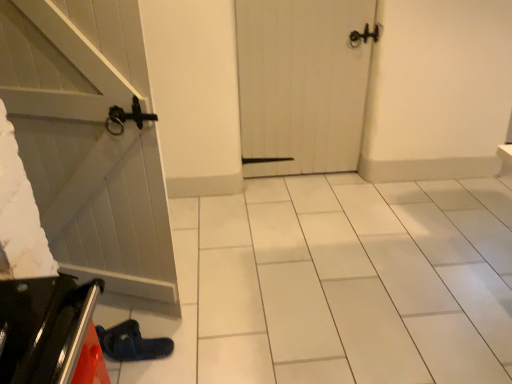
Describe the element at coordinates (303, 82) in the screenshot. The image size is (512, 384). I see `white wooden door at center` at that location.

Describe the element at coordinates (47, 330) in the screenshot. I see `shiny metallic oven at lower left` at that location.

In order to click on blue suede slipper at lower left in this screenshot , I will do `click(132, 343)`.

Where is `white wooden door at center`? The width and height of the screenshot is (512, 384). white wooden door at center is located at coordinates (303, 82).

Does white wooden door at center contain blue suede slipper at lower left?

No, blue suede slipper at lower left is not inside white wooden door at center.

Between white wooden door at center and blue suede slipper at lower left, which one has smaller width?

white wooden door at center is thinner.

Does white wooden door at center come in front of blue suede slipper at lower left?

No.

How different are the orientations of white wooden door at center and blue suede slipper at lower left in degrees?

The angular difference between white wooden door at center and blue suede slipper at lower left is 87.9 degrees.

In terms of height, does blue suede slipper at lower left look taller or shorter compared to white wooden door at center?

Clearly, blue suede slipper at lower left is shorter compared to white wooden door at center.

Looking at the image, does blue suede slipper at lower left seem bigger or smaller compared to white wooden door at center?

Clearly, blue suede slipper at lower left is smaller in size than white wooden door at center.

Does blue suede slipper at lower left have a lesser width compared to white wooden door at center?

No, blue suede slipper at lower left is not thinner than white wooden door at center.

Consider the image. Is blue suede slipper at lower left far away from white wooden door at center?

That's right, there is a large distance between blue suede slipper at lower left and white wooden door at center.

Who is smaller, white wooden door at center or shiny metallic oven at lower left?

With smaller size is shiny metallic oven at lower left.

Does white wooden door at center lie behind shiny metallic oven at lower left?

Yes, white wooden door at center is further from the viewer.

Considering the relative sizes of shiny metallic oven at lower left and white wooden door at center in the image provided, is shiny metallic oven at lower left bigger than white wooden door at center?

No, shiny metallic oven at lower left is not bigger than white wooden door at center.

From the picture: Are shiny metallic oven at lower left and white wooden door at center beside each other?

No, shiny metallic oven at lower left is not next to white wooden door at center.

Does shiny metallic oven at lower left come in front of white wooden door at center?

Yes, shiny metallic oven at lower left is in front of white wooden door at center.

Identify the location of footwear below the shiny metallic oven at lower left (from a real-world perspective). [132, 343].

Who is bigger, blue suede slipper at lower left or shiny metallic oven at lower left?

With larger size is shiny metallic oven at lower left.

Which is behind, point (103, 340) or point (69, 329)?

The point (103, 340) is more distant.

Considering the points (27, 287) and (122, 347), which point is behind, point (27, 287) or point (122, 347)?

Positioned behind is point (122, 347).

Considering the relative positions of shiny metallic oven at lower left and blue suede slipper at lower left in the image provided, is shiny metallic oven at lower left to the right of blue suede slipper at lower left from the viewer's perspective?

Answer: No, shiny metallic oven at lower left is not to the right of blue suede slipper at lower left.

Where is `appliance on the left of blue suede slipper at lower left`? appliance on the left of blue suede slipper at lower left is located at coordinates (47, 330).

Does shiny metallic oven at lower left have a larger size compared to blue suede slipper at lower left?

Yes.

Identify the location of footwear located underneath the white wooden door at center (from a real-world perspective). The height and width of the screenshot is (384, 512). (132, 343).

Find the location of a particular element. door behind the blue suede slipper at lower left is located at coordinates (303, 82).

Looking at this image, based on their spatial positions, is shiny metallic oven at lower left or blue suede slipper at lower left further from white wooden door at center?

shiny metallic oven at lower left lies further to white wooden door at center than the other object.

Looking at the image, which one is located further to white wooden door at center, blue suede slipper at lower left or shiny metallic oven at lower left?

shiny metallic oven at lower left.

When comparing their distances from blue suede slipper at lower left, does shiny metallic oven at lower left or white wooden door at center seem closer?

shiny metallic oven at lower left lies closer to blue suede slipper at lower left than the other object.

When comparing their distances from blue suede slipper at lower left, does white wooden door at center or shiny metallic oven at lower left seem closer?

Based on the image, shiny metallic oven at lower left appears to be nearer to blue suede slipper at lower left.

Which object lies further to the anchor point shiny metallic oven at lower left, blue suede slipper at lower left or white wooden door at center?

Among the two, white wooden door at center is located further to shiny metallic oven at lower left.

From the image, which object appears to be farther from shiny metallic oven at lower left, white wooden door at center or blue suede slipper at lower left?

white wooden door at center is positioned further to the anchor shiny metallic oven at lower left.

Locate an element on the screen. The height and width of the screenshot is (384, 512). appliance between white wooden door at center and blue suede slipper at lower left from top to bottom is located at coordinates (47, 330).